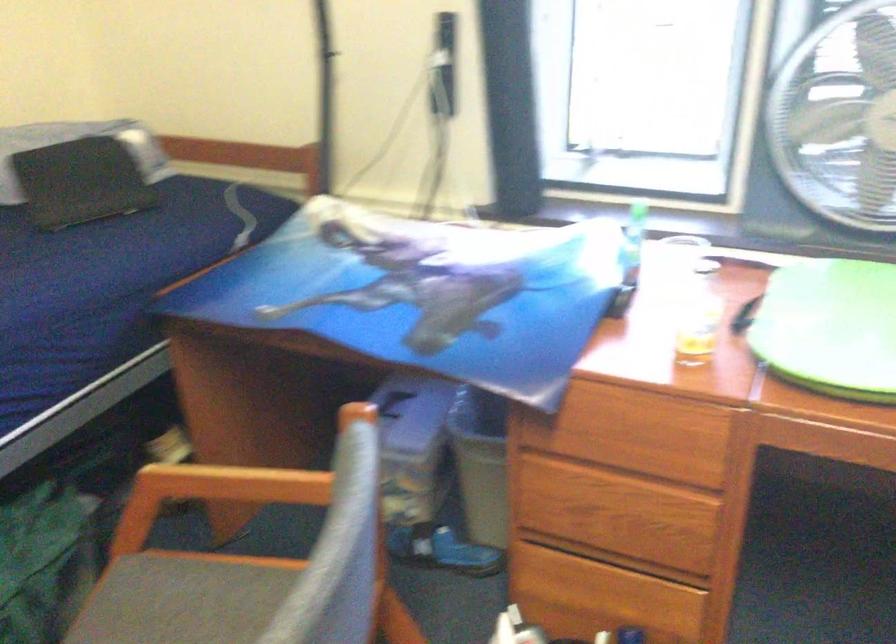
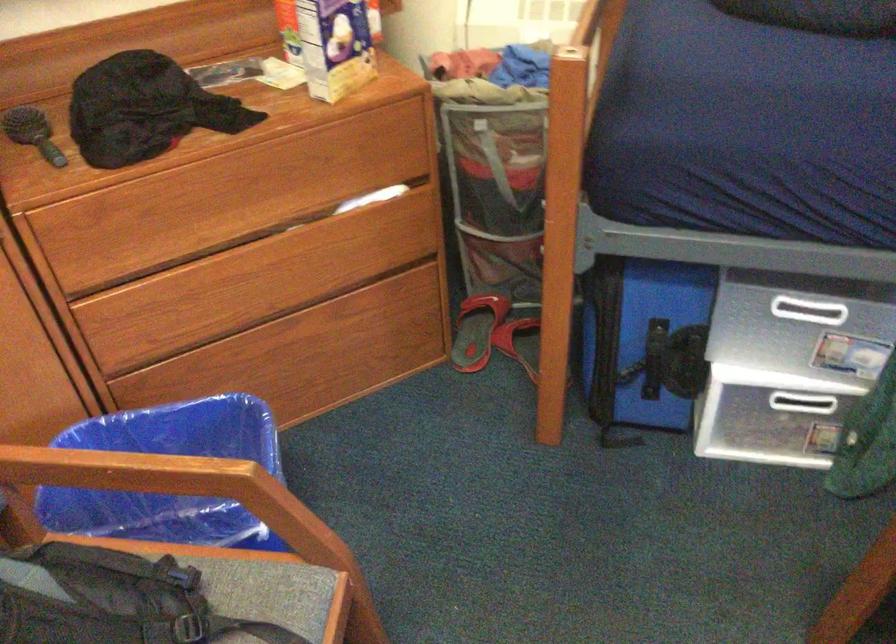
Based on the continuous images, in which direction is the camera rotating?

The camera rotated toward left-down.